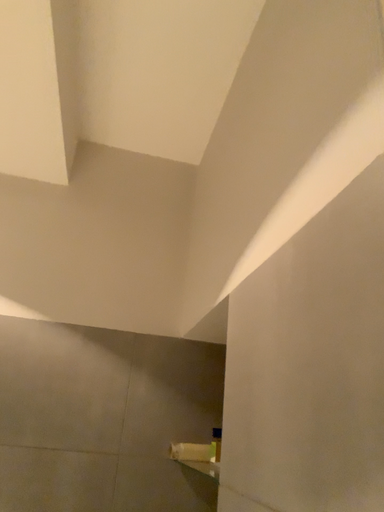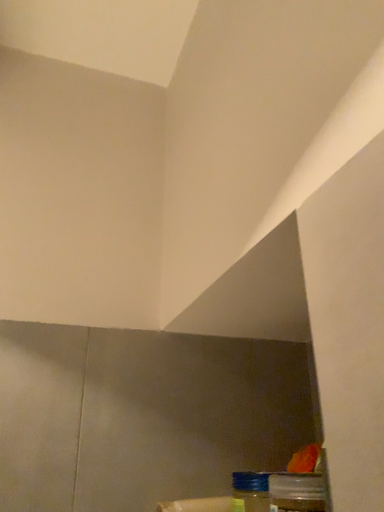
Question: Which way did the camera rotate in the video?

Choices:
 (A) rotated right
 (B) rotated left

Answer: (A)